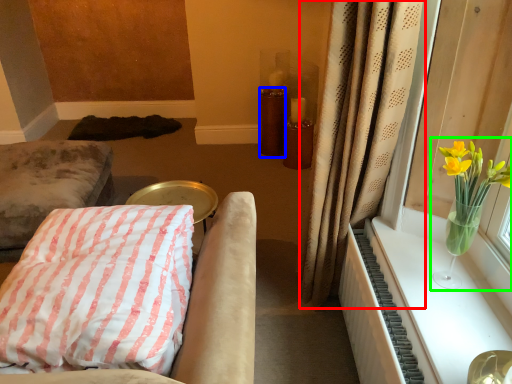
Question: Based on their relative distances, which object is farther from curtain (highlighted by a red box)? Choose from candle holder (highlighted by a blue box) and floral arrangement (highlighted by a green box).

Choices:
 (A) candle holder
 (B) floral arrangement

Answer: (A)